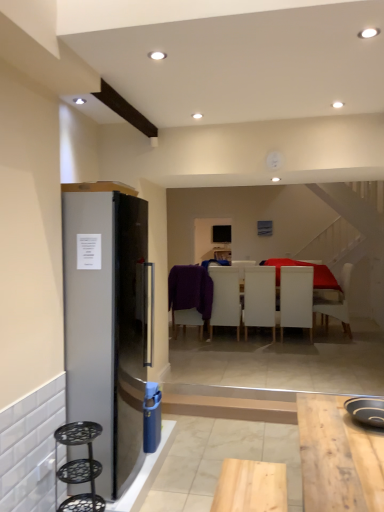
Question: In which direction should I rotate to look at purple fabric chair at center, which ranks as the 5th chair in right-to-left order?

Choices:
 (A) left
 (B) right

Answer: (B)

Question: Does white matte chair at center, which is counted as the 1th chair, starting from the right, have a greater height compared to black non-stick pan at lower right?

Choices:
 (A) yes
 (B) no

Answer: (A)

Question: Does white matte chair at center, the fifth chair positioned from the left, lie behind black non-stick pan at lower right?

Choices:
 (A) no
 (B) yes

Answer: (B)

Question: From the image's perspective, is white matte chair at center, the fifth chair positioned from the left, beneath black non-stick pan at lower right?

Choices:
 (A) no
 (B) yes

Answer: (A)

Question: From the image's perspective, is white matte chair at center, the fifth chair positioned from the left, located above black non-stick pan at lower right?

Choices:
 (A) no
 (B) yes

Answer: (B)

Question: Is white matte chair at center, which is counted as the 1th chair, starting from the right, next to black non-stick pan at lower right?

Choices:
 (A) yes
 (B) no

Answer: (B)

Question: From a real-world perspective, is white matte chair at center, the fifth chair positioned from the left, positioned under black non-stick pan at lower right based on gravity?

Choices:
 (A) yes
 (B) no

Answer: (A)

Question: Considering the relative sizes of white matte chair at center, the fifth chair positioned from the left, and black metal bar stool at left in the image provided, is white matte chair at center, the fifth chair positioned from the left, wider than black metal bar stool at left?

Choices:
 (A) no
 (B) yes

Answer: (B)

Question: From the image's perspective, is white matte chair at center, which is counted as the 1th chair, starting from the right, located above black metal bar stool at left?

Choices:
 (A) no
 (B) yes

Answer: (B)

Question: Is white matte chair at center, the fifth chair positioned from the left, positioned beyond the bounds of black metal bar stool at left?

Choices:
 (A) yes
 (B) no

Answer: (A)

Question: Considering the relative positions of white matte chair at center, which is counted as the 1th chair, starting from the right, and black metal bar stool at left in the image provided, is white matte chair at center, which is counted as the 1th chair, starting from the right, to the right of black metal bar stool at left from the viewer's perspective?

Choices:
 (A) yes
 (B) no

Answer: (A)

Question: Does white matte chair at center, which is counted as the 1th chair, starting from the right, have a smaller size compared to black metal bar stool at left?

Choices:
 (A) no
 (B) yes

Answer: (A)

Question: Could you tell me if white matte chair at center, the fifth chair positioned from the left, is facing black metal bar stool at left?

Choices:
 (A) no
 (B) yes

Answer: (A)

Question: From a real-world perspective, is white matte chair at center, which is counted as the 1th chair, starting from the right, on top of white matte chair at center, which is the third chair from left to right?

Choices:
 (A) yes
 (B) no

Answer: (B)